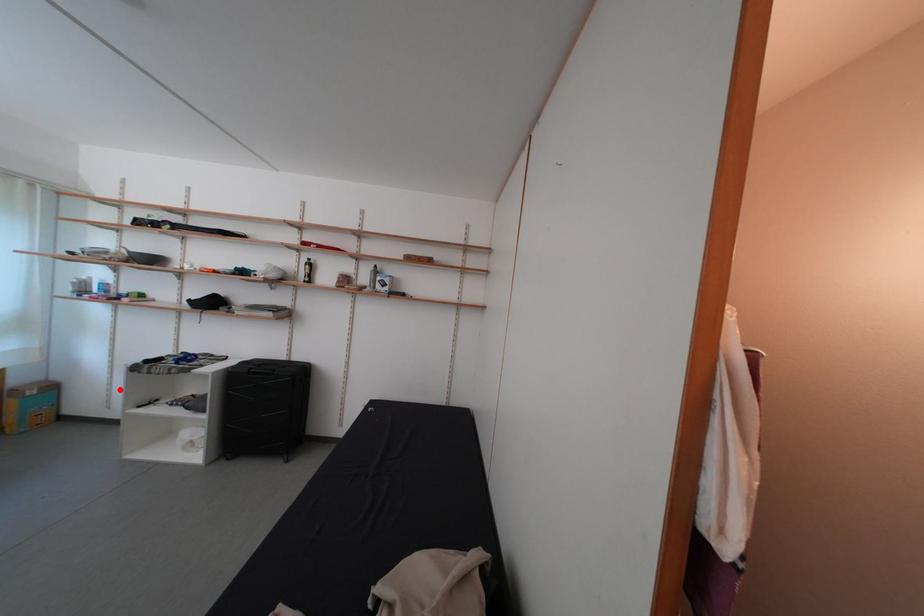
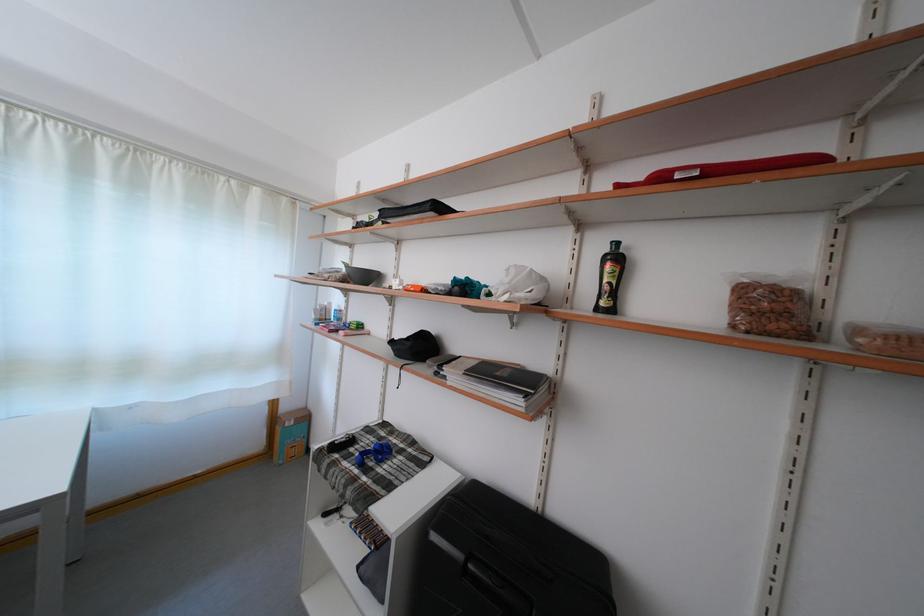
Question: I am providing you with two images of the same scene from different viewpoints. In image1, a red point is highlighted. Considering the same 3D point in image2, which of the following is correct?

Choices:
 (A) It is closer
 (B) It is farther

Answer: (B)